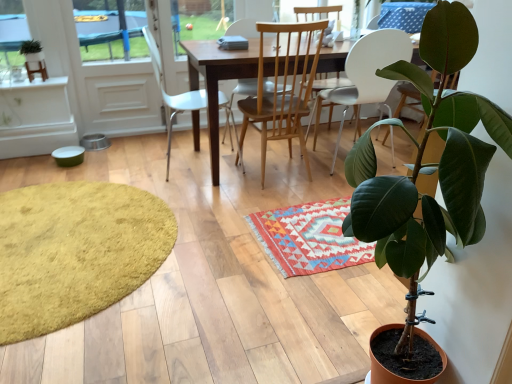
Where is `free point below yellow shaggy rug at lower left, which appears as the second mat when viewed from the right (from a real-world perspective)`? The image size is (512, 384). free point below yellow shaggy rug at lower left, which appears as the second mat when viewed from the right (from a real-world perspective) is located at coordinates (x=78, y=231).